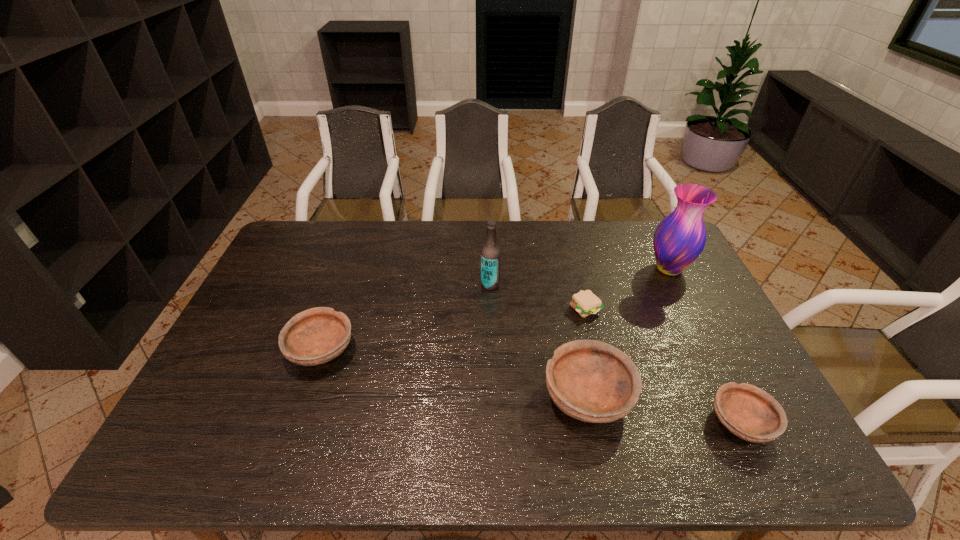
Locate an element on the screen. This screenshot has height=540, width=960. free space between the leftmost bowl and the shortest object is located at coordinates (453, 329).

What are the coordinates of `unoccupied position between the second bowl from right to left and the fifth tallest object` in the screenshot? It's located at (664, 409).

Where is `free space between the tallest object and the beer bottle`? free space between the tallest object and the beer bottle is located at coordinates click(x=580, y=276).

Identify the location of vacant area that lies between the fourth tallest object and the second bowl from right to left. (454, 373).

Select which object is the fifth closest to the tallest bowl. Please provide its 2D coordinates. Your answer should be formatted as a tuple, i.e. [(x, y)], where the tuple contains the x and y coordinates of a point satisfying the conditions above.

[(315, 336)]

This screenshot has width=960, height=540. Identify the location of object that stands as the second closest to the second shortest bowl. (592, 381).

What are the coordinates of `bowl that stands as the second closest to the fifth tallest object` in the screenshot? It's located at (315, 336).

The height and width of the screenshot is (540, 960). I want to click on bowl that is the closest one to the second object from left to right, so click(592, 381).

The width and height of the screenshot is (960, 540). Find the location of `free space in the image that satisfies the following two spatial constraints: 1. on the front side of the leftmost object; 2. on the right side of the rightmost bowl`. free space in the image that satisfies the following two spatial constraints: 1. on the front side of the leftmost object; 2. on the right side of the rightmost bowl is located at coordinates (296, 423).

Identify the location of free spot that satisfies the following two spatial constraints: 1. on the side of the shortest object with the label; 2. on the left side of the second object from left to right. (491, 308).